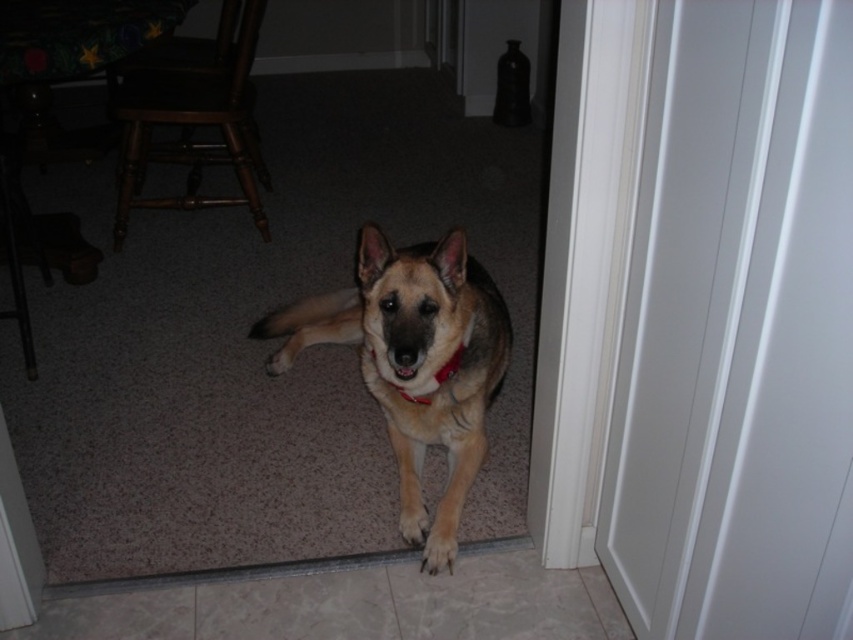
Is light brown fur at center closer to the viewer compared to brown fur paw at lower center?

Yes, it is in front of brown fur paw at lower center.

Which is more to the right, light brown fur at center or brown fur paw at lower center?

Positioned to the right is light brown fur at center.

Is point (444, 560) farther from camera compared to point (413, 532)?

No, (444, 560) is in front of (413, 532).

Where is `light brown fur at center`? This screenshot has height=640, width=853. light brown fur at center is located at coordinates click(439, 550).

Between point (376, 285) and point (416, 499), which one is positioned behind?

Positioned behind is point (416, 499).

Is golden fur dog at center below brown fur paw at lower center?

No.

Does point (254, 332) come farther from viewer compared to point (402, 531)?

That is True.

Locate an element on the screen. The width and height of the screenshot is (853, 640). golden fur dog at center is located at coordinates (415, 349).

Consider the image. Is white smooth door at center right to the left of red fabric neckband at center from the viewer's perspective?

Incorrect, white smooth door at center right is not on the left side of red fabric neckband at center.

Is the position of white smooth door at center right more distant than that of red fabric neckband at center?

No, white smooth door at center right is closer to the viewer.

Is point (813, 227) less distant than point (440, 374)?

Yes, point (813, 227) is closer to viewer.

The width and height of the screenshot is (853, 640). In order to click on white smooth door at center right in this screenshot , I will do `click(737, 332)`.